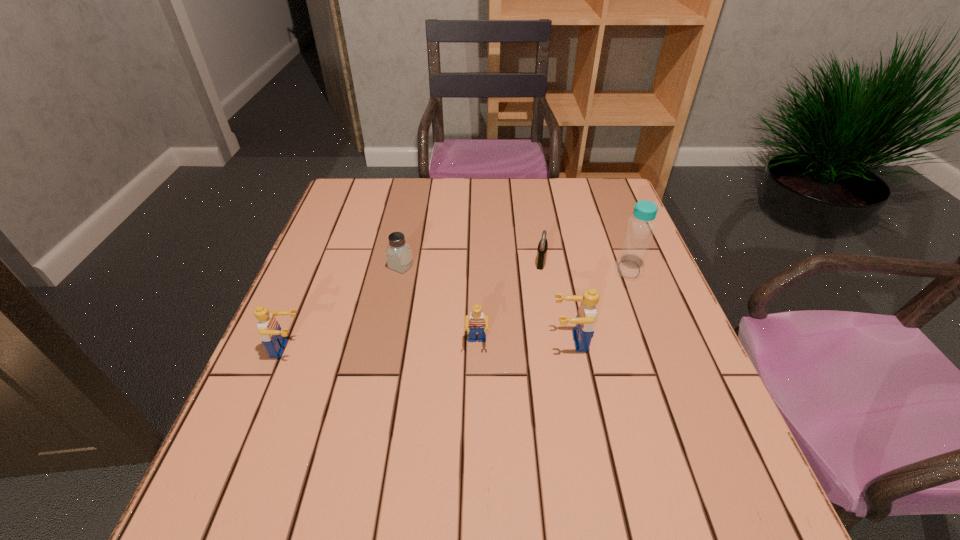
What are the coordinates of `the leftmost object` in the screenshot? It's located at (269, 329).

The width and height of the screenshot is (960, 540). In order to click on the leftmost Lego in this screenshot , I will do `click(269, 329)`.

You are a GUI agent. You are given a task and a screenshot of the screen. Output one action in this format:
    pyautogui.click(x=<x>, y=<y>)
    Task: Click on the shortest Lego
    
    Given the screenshot: What is the action you would take?
    pyautogui.click(x=476, y=322)

Locate an element on the screen. This screenshot has width=960, height=540. the fourth object from right to left is located at coordinates (476, 322).

Where is `the rightmost Lego`? Image resolution: width=960 pixels, height=540 pixels. the rightmost Lego is located at coordinates (585, 320).

The image size is (960, 540). What are the coordinates of `the fifth shortest object` in the screenshot? It's located at (585, 320).

Where is `padlock`? The width and height of the screenshot is (960, 540). padlock is located at coordinates (543, 244).

The image size is (960, 540). Identify the location of saltshaker. (399, 257).

You are a GUI agent. You are given a task and a screenshot of the screen. Output one action in this format:
    pyautogui.click(x=<x>, y=<y>)
    Task: Click on the bottle
    
    Given the screenshot: What is the action you would take?
    pyautogui.click(x=630, y=264)

Locate an element on the screen. Image resolution: width=960 pixels, height=540 pixels. the tallest object is located at coordinates (630, 264).